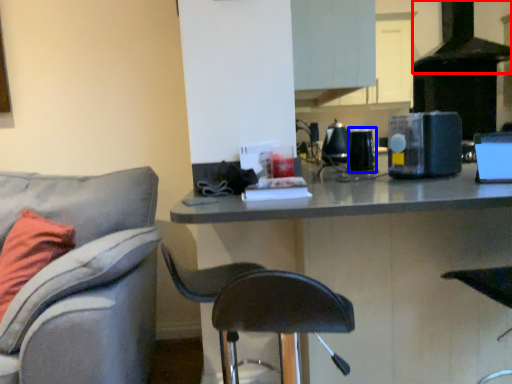
Question: Which object is closer to the camera taking this photo, exhaust hood (highlighted by a red box) or appliance (highlighted by a blue box)?

Choices:
 (A) exhaust hood
 (B) appliance

Answer: (B)